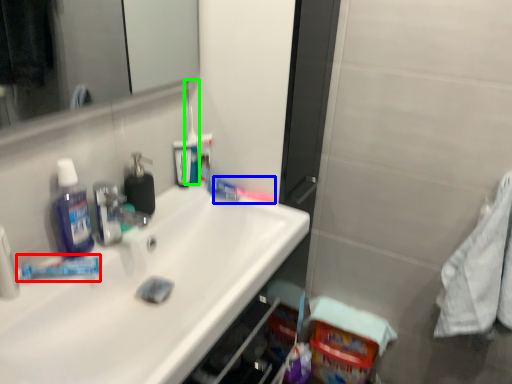
Question: Which object is positioned closest to toothpaste (highlighted by a red box)? Select from toothbrush (highlighted by a blue box) and toothbrush (highlighted by a green box).

Choices:
 (A) toothbrush
 (B) toothbrush

Answer: (B)